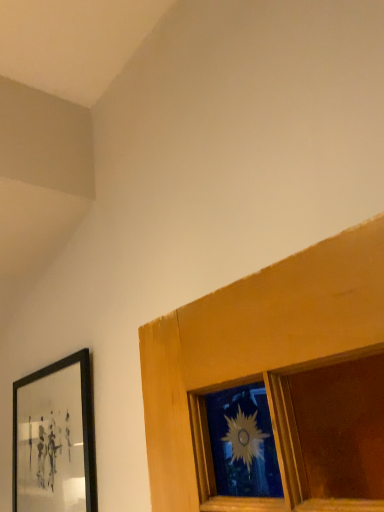
At what (x,y) coordinates should I click in order to perform the action: click on black matte picture frame at left. Please return your answer as a coordinate pair (x, y). This screenshot has width=384, height=512. Looking at the image, I should click on (55, 439).

Measure the distance between point (37, 453) and camera.

Point (37, 453) and camera are 3.96 feet apart from each other.

What do you see at coordinates (55, 439) in the screenshot? This screenshot has height=512, width=384. I see `black matte picture frame at left` at bounding box center [55, 439].

Looking at this image, in order to face black matte picture frame at left, should I rotate leftwards or rightwards?

A 19.376 degree turn to the left will do.

Identify the location of black matte picture frame at left. (55, 439).